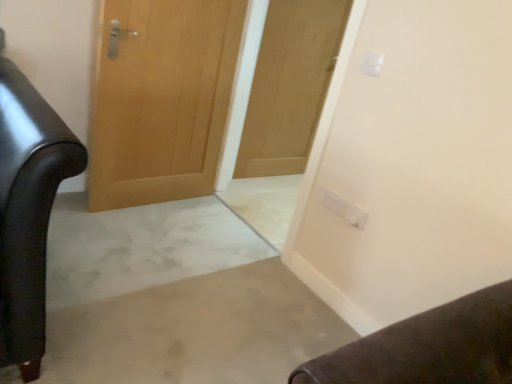
Question: In terms of height, does white plastic electric outlet at upper right, positioned as the 2th electric outlet in front-to-back order, look taller or shorter compared to wooden door at center, the first door from the right?

Choices:
 (A) tall
 (B) short

Answer: (B)

Question: From the image's perspective, relative to wooden door at center, which is the second door in left-to-right order, is white plastic electric outlet at upper right, marked as the third electric outlet in a top-to-bottom arrangement, above or below?

Choices:
 (A) below
 (B) above

Answer: (A)

Question: Based on their relative distances, which object is farther from the white plastic electric outlet at upper center, marked as the third electric outlet in a bottom-to-top arrangement?

Choices:
 (A) white plastic electric outlet at upper right, arranged as the 2th electric outlet when viewed from the top
 (B) wooden door at center, which is the 1th door in left-to-right order
 (C) wooden door at center, which is the second door in left-to-right order
 (D) white plastic electric outlet at upper right, acting as the 2th electric outlet starting from the back

Answer: (C)

Question: Considering the real-world distances, which object is farthest from the wooden door at center, the second door positioned from the right?

Choices:
 (A) white plastic electric outlet at upper right, the 1th electric outlet when ordered from bottom to top
 (B) wooden door at center, the first door from the right
 (C) white plastic electric outlet at upper center, the first electric outlet in the front-to-back sequence
 (D) white plastic electric outlet at upper right, acting as the 1th electric outlet starting from the back

Answer: (A)